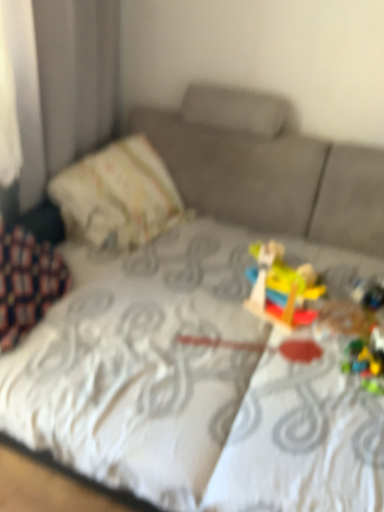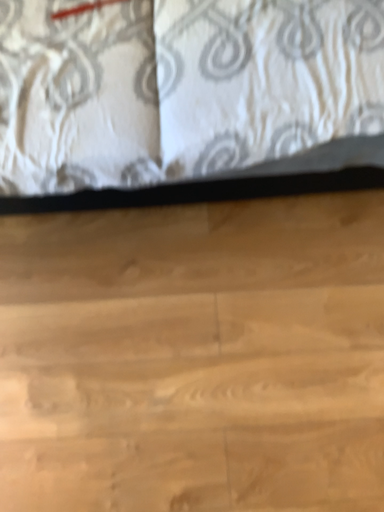
Question: Which way did the camera rotate in the video?

Choices:
 (A) rotated upward
 (B) rotated downward

Answer: (B)